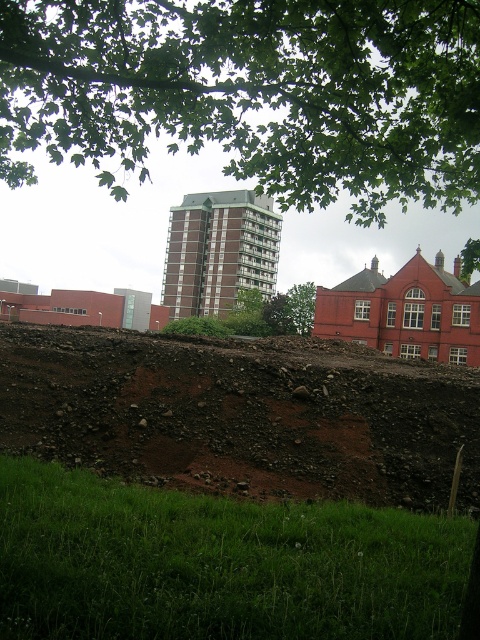
Who is lower down, green leafy tree at upper center or brown rocky dirt at lower center?

brown rocky dirt at lower center is below.

Does green leafy tree at upper center have a lesser height compared to brown rocky dirt at lower center?

No.

You are a GUI agent. You are given a task and a screenshot of the screen. Output one action in this format:
    pyautogui.click(x=<x>, y=<y>)
    Task: Click on the green leafy tree at upper center
    
    Given the screenshot: What is the action you would take?
    pyautogui.click(x=252, y=92)

This screenshot has height=640, width=480. Identify the location of green leafy tree at upper center. (252, 92).

Between brown rocky dirt at lower center and green leafy tree at center, which one has more height?

Standing taller between the two is green leafy tree at center.

Does brown rocky dirt at lower center appear on the right side of green leafy tree at center?

Incorrect, brown rocky dirt at lower center is not on the right side of green leafy tree at center.

Measure the distance between brown rocky dirt at lower center and camera.

They are 10.51 meters apart.

Where is `brown rocky dirt at lower center`? The image size is (480, 640). brown rocky dirt at lower center is located at coordinates (241, 413).

Is green leafy tree at upper center shorter than green leafy tree at center?

Incorrect, green leafy tree at upper center's height does not fall short of green leafy tree at center's.

Who is taller, green leafy tree at upper center or green leafy tree at center?

green leafy tree at upper center

What do you see at coordinates (252, 92) in the screenshot?
I see `green leafy tree at upper center` at bounding box center [252, 92].

Find the location of a particular element. Image resolution: width=480 pixels, height=640 pixels. green leafy tree at upper center is located at coordinates [252, 92].